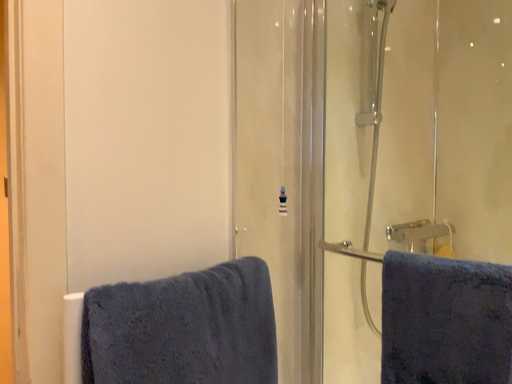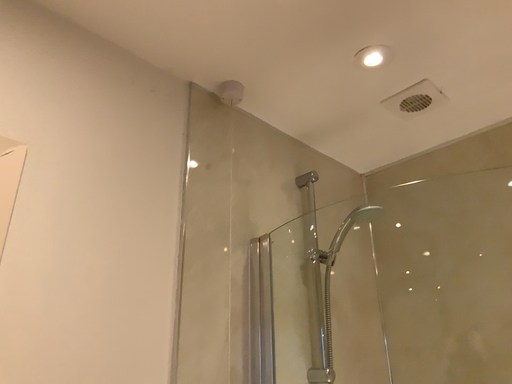
Question: How did the camera likely rotate when shooting the video?

Choices:
 (A) rotated left
 (B) rotated right

Answer: (B)